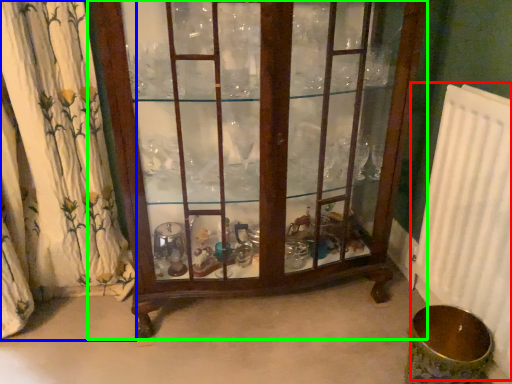
Question: Which object is positioned closest to radiator (highlighted by a red box)? Select from curtain (highlighted by a blue box) and furniture (highlighted by a green box).

Choices:
 (A) curtain
 (B) furniture

Answer: (B)